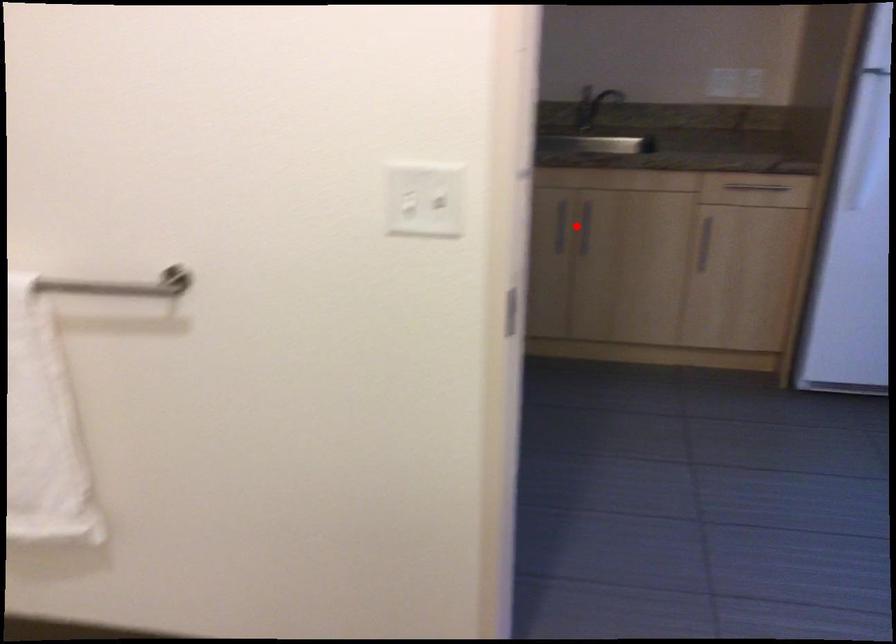
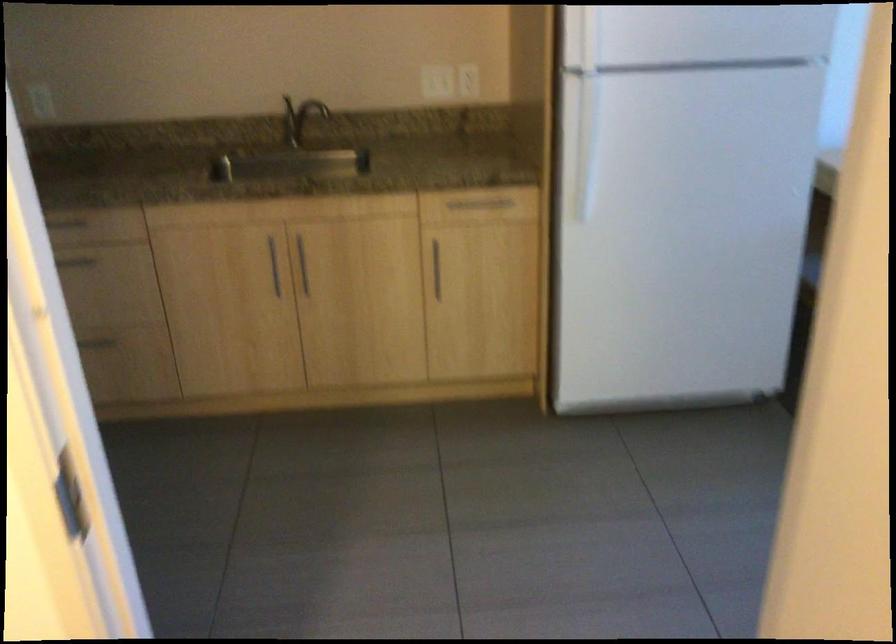
Question: I am providing you with two images of the same scene from different viewpoints. In image1, a red point is highlighted. Considering the same 3D point in image2, which of the following is correct?

Choices:
 (A) It is closer
 (B) It is farther

Answer: (A)